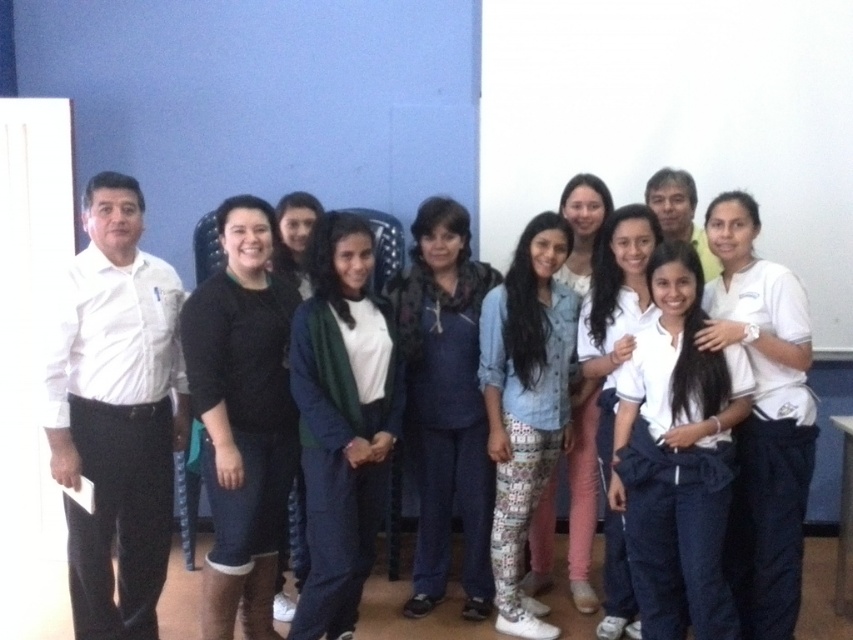
Question: Which object is the farthest from the denim shirt at center?

Choices:
 (A) dark blue denim pants at center
 (B) white matte shirt at left
 (C) dark blue tracksuit at center

Answer: (B)

Question: Which object is farther from the camera taking this photo?

Choices:
 (A) dark blue tracksuit at center
 (B) denim shirt at center
 (C) white matte shirt at left
 (D) dark blue denim pants at center

Answer: (B)

Question: Can you confirm if black matte sweater at center is wider than dark blue tracksuit at center?

Choices:
 (A) no
 (B) yes

Answer: (A)

Question: Among these objects, which one is nearest to the camera?

Choices:
 (A) white matte shirt at left
 (B) black matte sweater at center
 (C) dark blue denim pants at center
 (D) dark blue tracksuit at center

Answer: (A)

Question: Is dark blue tracksuit at center further to the viewer compared to denim shirt at center?

Choices:
 (A) yes
 (B) no

Answer: (B)

Question: Where is dark blue denim pants at center located in relation to denim shirt at center in the image?

Choices:
 (A) right
 (B) left

Answer: (B)